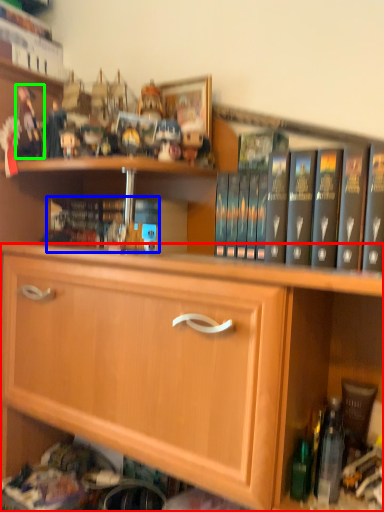
Question: Which object is positioned closest to cabinetry (highlighted by a red box)? Select from book (highlighted by a blue box) and toy (highlighted by a green box).

Choices:
 (A) book
 (B) toy

Answer: (A)